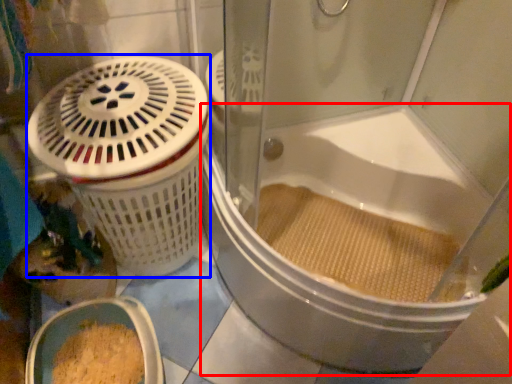
Question: Among these objects, which one is nearest to the camera, bathtub (highlighted by a red box) or basket container (highlighted by a blue box)?

Choices:
 (A) bathtub
 (B) basket container

Answer: (A)